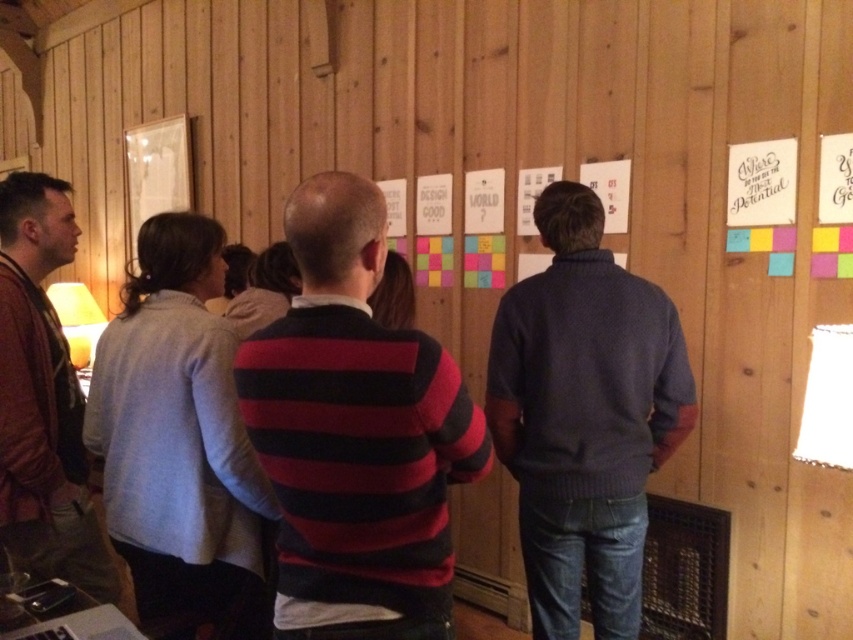
Does striped sweater at center lie behind dark blue sweater at center?

No, striped sweater at center is in front of dark blue sweater at center.

Is striped sweater at center positioned before dark blue sweater at center?

Yes, striped sweater at center is closer to the viewer.

Is point (397, 600) more distant than point (492, 371)?

No, (397, 600) is in front of (492, 371).

Where is `striped sweater at center`? The height and width of the screenshot is (640, 853). striped sweater at center is located at coordinates (355, 435).

Who is taller, dark blue sweater at center or leather jacket at left?

With more height is dark blue sweater at center.

Looking at this image, does dark blue sweater at center have a greater height compared to leather jacket at left?

Yes.

The width and height of the screenshot is (853, 640). In order to click on dark blue sweater at center in this screenshot , I will do `click(584, 417)`.

Is striped sweater at center wider than leather jacket at left?

Yes.

You are a GUI agent. You are given a task and a screenshot of the screen. Output one action in this format:
    pyautogui.click(x=<x>, y=<y>)
    Task: Click on the striped sweater at center
    
    Given the screenshot: What is the action you would take?
    pyautogui.click(x=355, y=435)

The image size is (853, 640). Find the location of `striped sweater at center`. striped sweater at center is located at coordinates (355, 435).